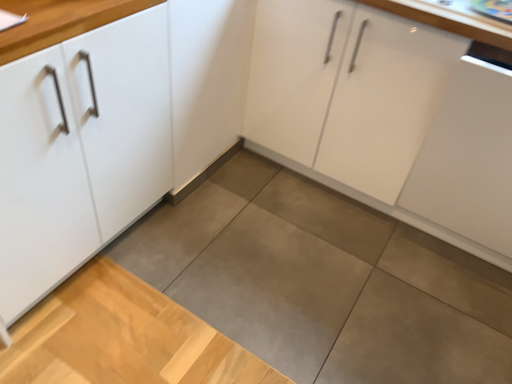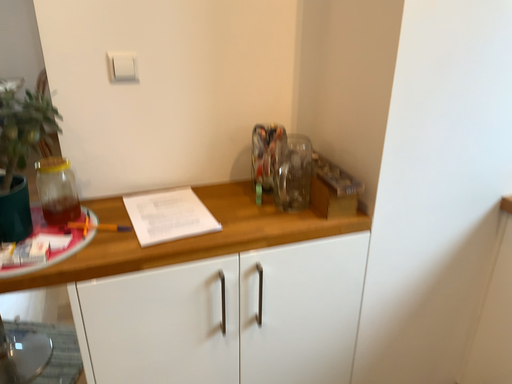
Question: How did the camera likely rotate when shooting the video?

Choices:
 (A) rotated right
 (B) rotated left

Answer: (B)